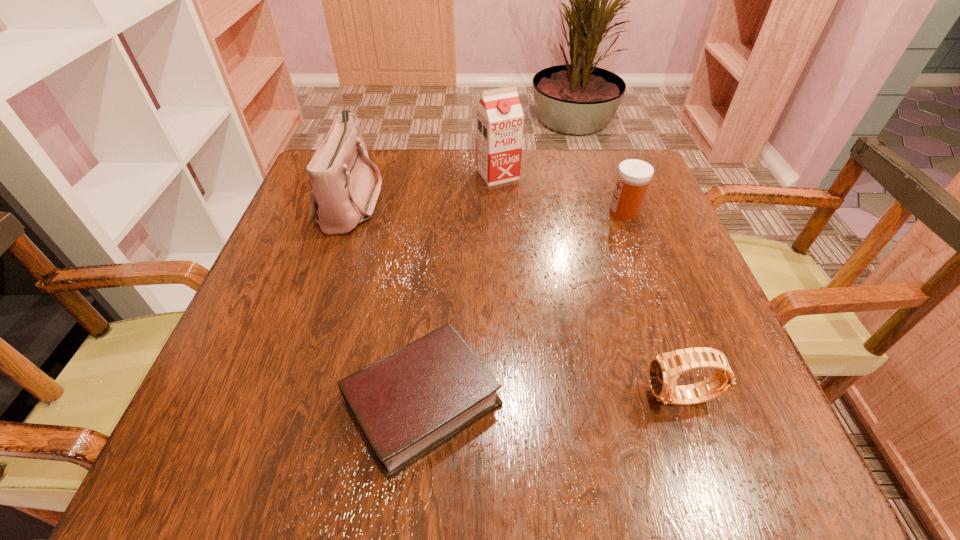
Locate an element on the screen. The width and height of the screenshot is (960, 540). soya milk is located at coordinates (499, 116).

What are the coordinates of `shoulder bag` in the screenshot? It's located at (343, 194).

Locate an element on the screen. The height and width of the screenshot is (540, 960). the leftmost object is located at coordinates (343, 194).

Locate an element on the screen. The height and width of the screenshot is (540, 960). medicine is located at coordinates (634, 175).

Locate an element on the screen. The image size is (960, 540). watch is located at coordinates (664, 369).

At what (x,y) coordinates should I click in order to perform the action: click on the shortest object. Please return your answer as a coordinate pair (x, y). The image size is (960, 540). Looking at the image, I should click on (407, 403).

Where is `free space located on the left of the tallest object`? free space located on the left of the tallest object is located at coordinates (392, 174).

Find the location of a particular element. The width and height of the screenshot is (960, 540). vacant space located 0.360m on the front pocket of the shoulder bag is located at coordinates (536, 201).

Locate an element on the screen. free location located 0.270m on the front of the medicine is located at coordinates (663, 318).

In order to click on free region located on the face of the watch in this screenshot , I will do `click(431, 398)`.